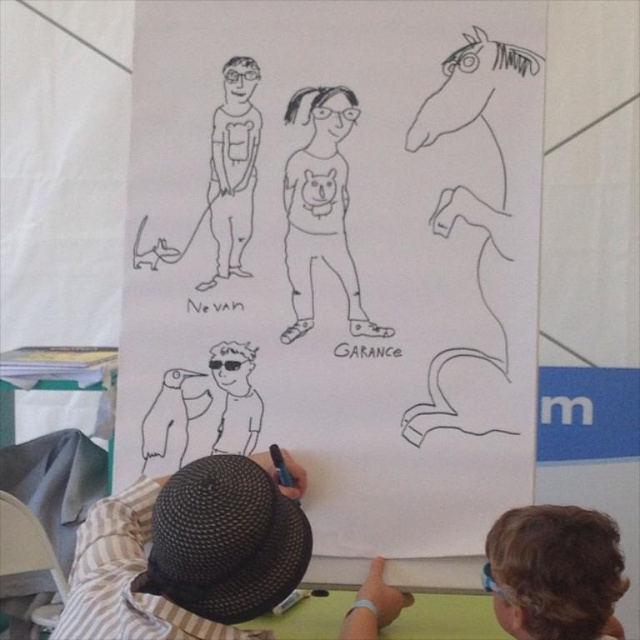
Is point (621, 636) positioned behind point (332, 108)?

No, (621, 636) is in front of (332, 108).

What do you see at coordinates (556, 572) in the screenshot? Image resolution: width=640 pixels, height=640 pixels. I see `brown hair at lower right` at bounding box center [556, 572].

What are the coordinates of `brown hair at lower right` in the screenshot? It's located at pos(556,572).